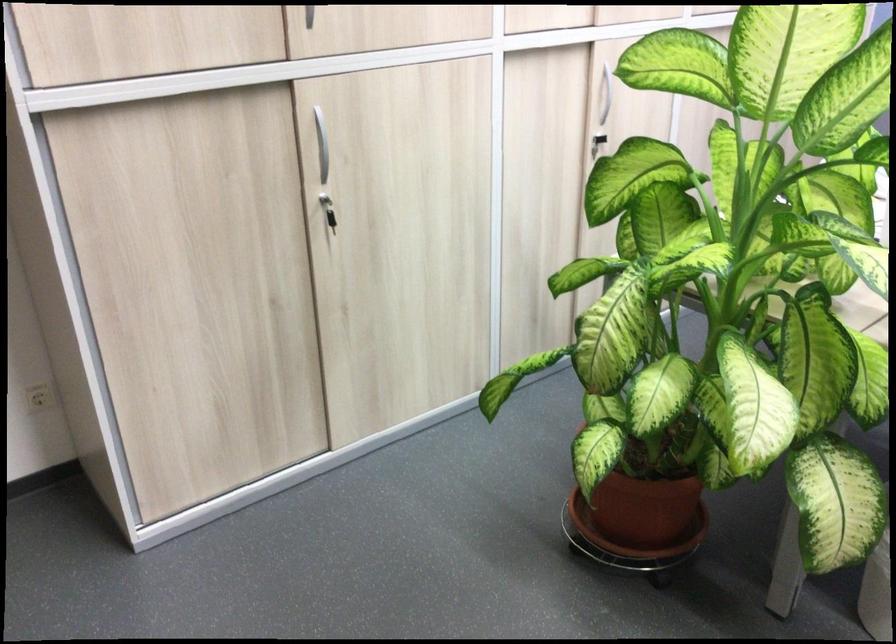
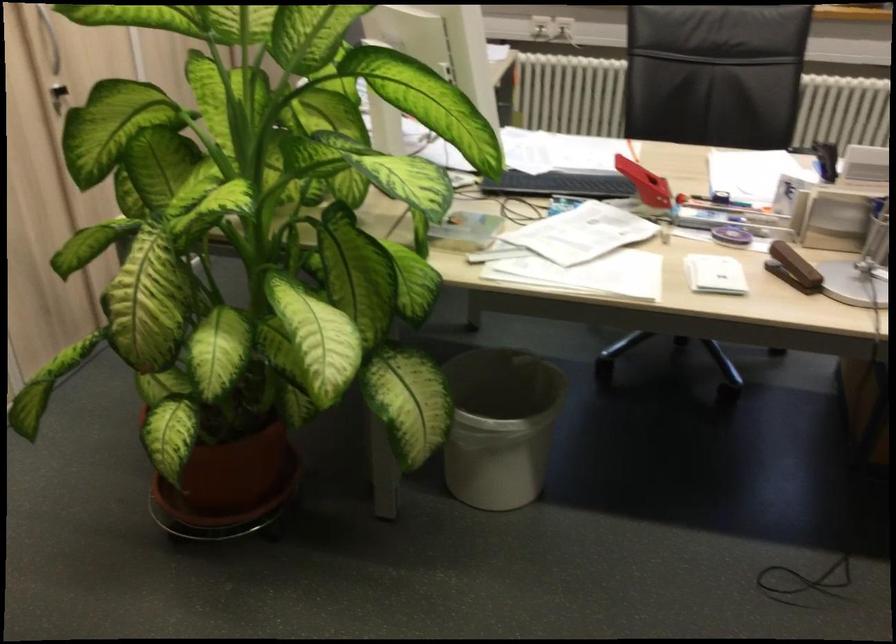
Question: The camera is either moving clockwise (left) or counter-clockwise (right) around the object. The first image is from the beginning of the video and the second image is from the end. Is the camera moving left or right when shooting the video?

Choices:
 (A) Left
 (B) Right

Answer: (A)